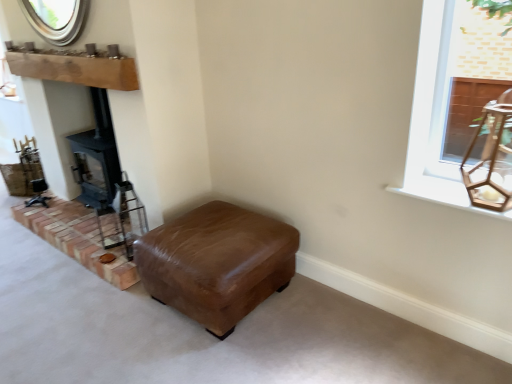
Measure the distance between brown leather ottoman at center and camera.

5.90 feet.

This screenshot has height=384, width=512. I want to click on natural wood mantle at upper left, so click(x=76, y=70).

Is white wood window sill at upper right wider than natural wood mantle at upper left?

Yes.

Considering the sizes of objects white wood window sill at upper right and natural wood mantle at upper left in the image provided, who is bigger, white wood window sill at upper right or natural wood mantle at upper left?

With larger size is natural wood mantle at upper left.

From a real-world perspective, who is located lower, white wood window sill at upper right or natural wood mantle at upper left?

From a 3D spatial view, white wood window sill at upper right is below.

Does point (122, 63) lie in front of point (435, 197)?

No.

Between natural wood mantle at upper left and white wood window sill at upper right, which one has larger width?

With larger width is white wood window sill at upper right.

Would you say natural wood mantle at upper left contains white wood window sill at upper right?

No, white wood window sill at upper right is not surrounded by natural wood mantle at upper left.

How different are the orientations of brown brickwork at lower left and brown leather ottoman at center in degrees?

brown brickwork at lower left and brown leather ottoman at center are facing 0.000488 degrees away from each other.

Would you say brown brickwork at lower left is a long distance from brown leather ottoman at center?

That's not correct — brown brickwork at lower left is a little close to brown leather ottoman at center.

From a real-world perspective, is brown brickwork at lower left on top of brown leather ottoman at center?

Actually, brown brickwork at lower left is physically below brown leather ottoman at center in the real world.

Is brown leather ottoman at center a part of white wood window sill at upper right?

No, brown leather ottoman at center is not a part of white wood window sill at upper right.

Can you confirm if white wood window sill at upper right is positioned to the left of brown leather ottoman at center?

Incorrect, white wood window sill at upper right is not on the left side of brown leather ottoman at center.

Locate an element on the screen. This screenshot has height=384, width=512. window sill located above the brown leather ottoman at center (from the image's perspective) is located at coordinates (443, 194).

How many degrees apart are the facing directions of white wood window sill at upper right and brown brickwork at lower left?

0.847 degrees separate the facing orientations of white wood window sill at upper right and brown brickwork at lower left.

Is white wood window sill at upper right wider or thinner than brown brickwork at lower left?

Considering their sizes, white wood window sill at upper right looks slimmer than brown brickwork at lower left.

From the image's perspective, relative to brown brickwork at lower left, is white wood window sill at upper right above or below?

Based on their image positions, white wood window sill at upper right is located above brown brickwork at lower left.

Does point (418, 194) come in front of point (89, 218)?

Yes.

From the image's perspective, is brown leather ottoman at center on top of natural wood mantle at upper left?

No, from the image's perspective, brown leather ottoman at center is not above natural wood mantle at upper left.

Considering the relative positions of brown leather ottoman at center and natural wood mantle at upper left in the image provided, is brown leather ottoman at center to the left of natural wood mantle at upper left from the viewer's perspective?

Incorrect, brown leather ottoman at center is not on the left side of natural wood mantle at upper left.

Is brown leather ottoman at center not inside natural wood mantle at upper left?

Yes.

I want to click on window sill positioned vertically above the brown brickwork at lower left (from a real-world perspective), so click(443, 194).

Is point (68, 255) farther from viewer compared to point (454, 204)?

Yes, it is behind point (454, 204).

Between brown brickwork at lower left and white wood window sill at upper right, which one appears on the right side from the viewer's perspective?

white wood window sill at upper right is more to the right.

Find the location of a particular element. This screenshot has height=384, width=512. mantle lying on the left of white wood window sill at upper right is located at coordinates (76, 70).

Where is `mantle behind the white wood window sill at upper right`? mantle behind the white wood window sill at upper right is located at coordinates (76, 70).

Looking at the image, which one is located further to brown brickwork at lower left, white wood window sill at upper right or natural wood mantle at upper left?

white wood window sill at upper right lies further to brown brickwork at lower left than the other object.

Estimate the real-world distances between objects in this image. Which object is further from brown brickwork at lower left, natural wood mantle at upper left or white wood window sill at upper right?

white wood window sill at upper right is positioned further to the anchor brown brickwork at lower left.

Which object lies further to the anchor point natural wood mantle at upper left, brown brickwork at lower left or white wood window sill at upper right?

Among the two, white wood window sill at upper right is located further to natural wood mantle at upper left.

Looking at the image, which one is located further to brown leather ottoman at center, natural wood mantle at upper left or brown brickwork at lower left?

Based on the image, natural wood mantle at upper left appears to be further to brown leather ottoman at center.

When comparing their distances from natural wood mantle at upper left, does brown brickwork at lower left or brown leather ottoman at center seem further?

brown leather ottoman at center is positioned further to the anchor natural wood mantle at upper left.

Based on the photo, from the image, which object appears to be nearer to natural wood mantle at upper left, brown leather ottoman at center or white wood window sill at upper right?

The object closer to natural wood mantle at upper left is brown leather ottoman at center.

Considering their positions, is brown leather ottoman at center positioned closer to white wood window sill at upper right than brown brickwork at lower left?

brown leather ottoman at center is positioned closer to the anchor white wood window sill at upper right.

In the scene shown: Estimate the real-world distances between objects in this image. Which object is further from natural wood mantle at upper left, white wood window sill at upper right or brown leather ottoman at center?

The object further to natural wood mantle at upper left is white wood window sill at upper right.

Where is `brickwork between natural wood mantle at upper left and brown leather ottoman at center from top to bottom`? This screenshot has height=384, width=512. brickwork between natural wood mantle at upper left and brown leather ottoman at center from top to bottom is located at coordinates (77, 238).

The image size is (512, 384). I want to click on furniture located between brown brickwork at lower left and white wood window sill at upper right in the left-right direction, so click(x=217, y=263).

I want to click on furniture between natural wood mantle at upper left and white wood window sill at upper right in the horizontal direction, so click(217, 263).

The image size is (512, 384). Identify the location of brickwork situated between natural wood mantle at upper left and white wood window sill at upper right from left to right. (77, 238).